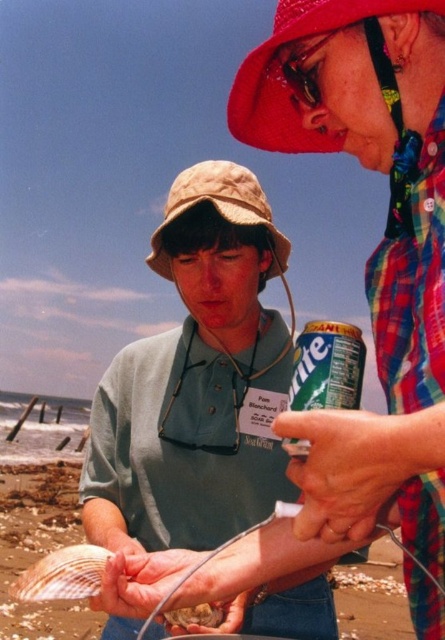
Question: Which object appears farthest from the camera in this image?

Choices:
 (A) tan fabric bucket hat at center
 (B) red fabric hat at upper center
 (C) fuzzy brown fur at lower center
 (D) plaid fabric shirt at upper right

Answer: (A)

Question: Where is red fabric hat at upper center located in relation to shiny white shell at lower left in the image?

Choices:
 (A) above
 (B) below

Answer: (A)

Question: Does plaid fabric shirt at upper right have a greater width compared to tan fabric bucket hat at center?

Choices:
 (A) no
 (B) yes

Answer: (A)

Question: Among these objects, which one is nearest to the camera?

Choices:
 (A) shiny white shell at lower left
 (B) white shell at center
 (C) green matte shirt at center

Answer: (B)

Question: Does tan fabric bucket hat at center have a greater width compared to fuzzy brown fur at lower center?

Choices:
 (A) no
 (B) yes

Answer: (B)

Question: Which point appears farthest from the camera in this image?

Choices:
 (A) (250, 131)
 (B) (79, 572)
 (C) (238, 433)

Answer: (C)